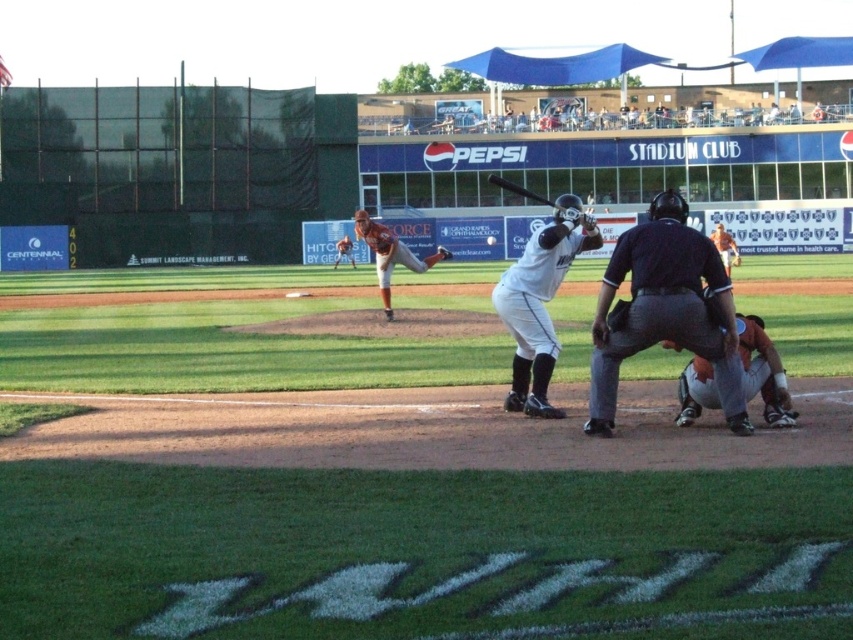
You are a spectator sitting in the stands watching the baseball game. You notice the dark blue uniform at center and the orange uniform catcher at lower right. Which player is positioned closer to you?

The dark blue uniform at center is closer to the viewer than the orange uniform catcher at lower right, so the dark blue uniform at center is positioned closer to you.

You are a spectator at the baseball game and want to take a photo of the orange uniformed pitcher at center and the brown leather glove at center. If your camera can only focus on objects wider than 1 meter, will both objects be in focus?

The orange uniformed pitcher at center might be wider than brown leather glove at center, so the pitcher should be in focus, but the glove might be too small. Check the actual width.